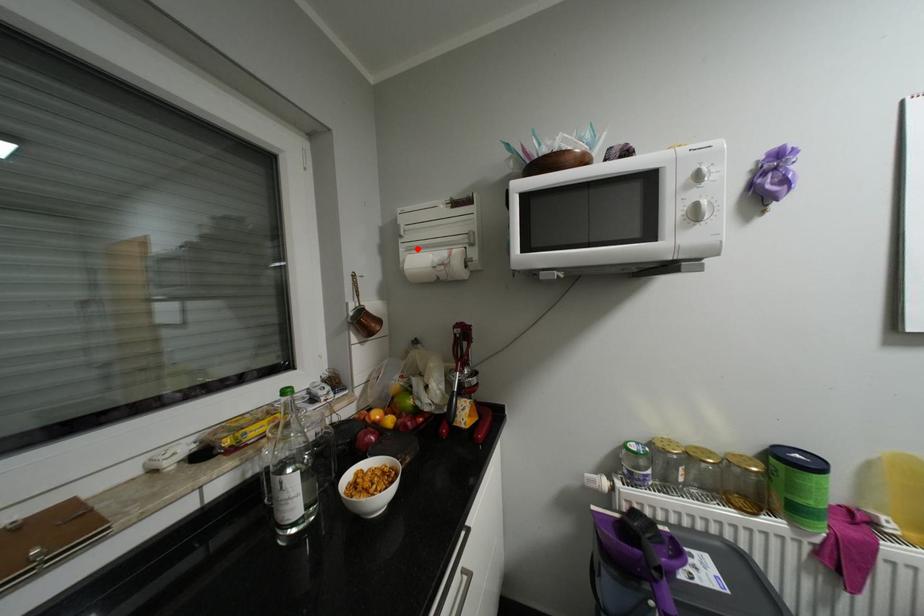
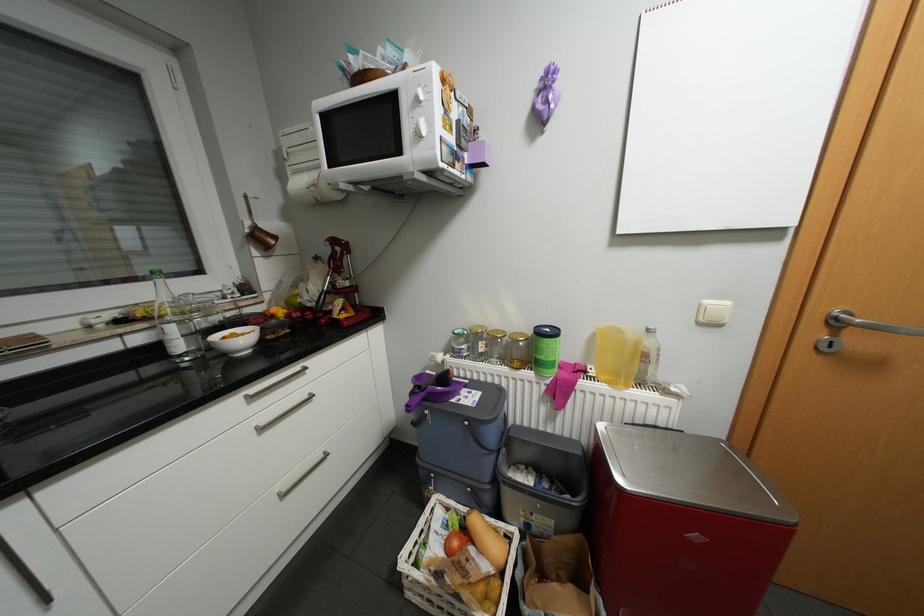
Question: I am providing you with two images of the same scene from different viewpoints. A red point is marked on the first image. Can you still see the location of the red point in image 2?

Choices:
 (A) Yes
 (B) No

Answer: (A)